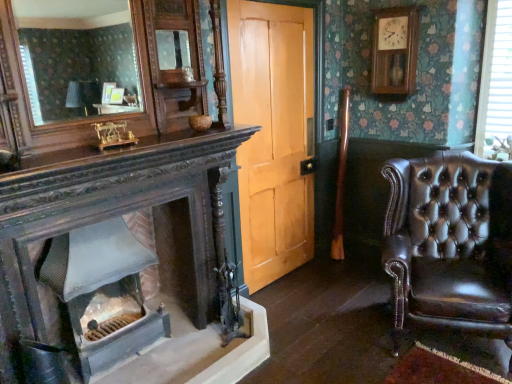
Question: Is smooth gray stone fireplace at lower left not near shiny brown leather armchair at right?

Choices:
 (A) yes
 (B) no

Answer: (A)

Question: Can you confirm if smooth gray stone fireplace at lower left is bigger than shiny brown leather armchair at right?

Choices:
 (A) no
 (B) yes

Answer: (A)

Question: From a real-world perspective, is smooth gray stone fireplace at lower left positioned under shiny brown leather armchair at right based on gravity?

Choices:
 (A) yes
 (B) no

Answer: (A)

Question: Is smooth gray stone fireplace at lower left at the right side of shiny brown leather armchair at right?

Choices:
 (A) no
 (B) yes

Answer: (A)

Question: From a real-world perspective, is smooth gray stone fireplace at lower left on top of shiny brown leather armchair at right?

Choices:
 (A) no
 (B) yes

Answer: (A)

Question: Is white plastic blinds at upper right situated inside shiny brown leather armchair at right or outside?

Choices:
 (A) inside
 (B) outside

Answer: (B)

Question: From the image's perspective, is white plastic blinds at upper right above or below shiny brown leather armchair at right?

Choices:
 (A) above
 (B) below

Answer: (A)

Question: Is white plastic blinds at upper right to the left or to the right of shiny brown leather armchair at right in the image?

Choices:
 (A) left
 (B) right

Answer: (B)

Question: Is white plastic blinds at upper right wider or thinner than shiny brown leather armchair at right?

Choices:
 (A) thin
 (B) wide

Answer: (A)

Question: From a real-world perspective, is shiny brown leather armchair at right above or below light brown wood door at center?

Choices:
 (A) above
 (B) below

Answer: (B)

Question: Is shiny brown leather armchair at right spatially inside light brown wood door at center, or outside of it?

Choices:
 (A) inside
 (B) outside

Answer: (B)

Question: Looking at the image, does shiny brown leather armchair at right seem bigger or smaller compared to light brown wood door at center?

Choices:
 (A) big
 (B) small

Answer: (A)

Question: In terms of height, does shiny brown leather armchair at right look taller or shorter compared to light brown wood door at center?

Choices:
 (A) tall
 (B) short

Answer: (B)

Question: Choose the correct answer: Is smooth gray stone fireplace at lower left inside light brown wood door at center or outside it?

Choices:
 (A) inside
 (B) outside

Answer: (B)

Question: Is smooth gray stone fireplace at lower left taller or shorter than light brown wood door at center?

Choices:
 (A) tall
 (B) short

Answer: (B)